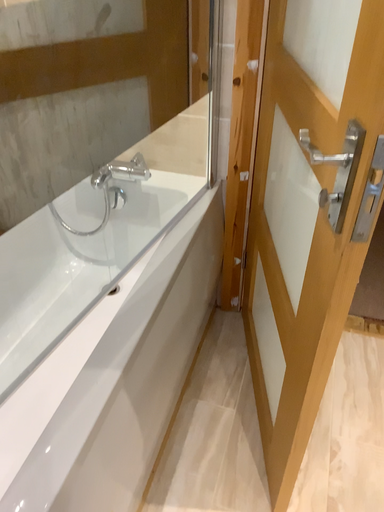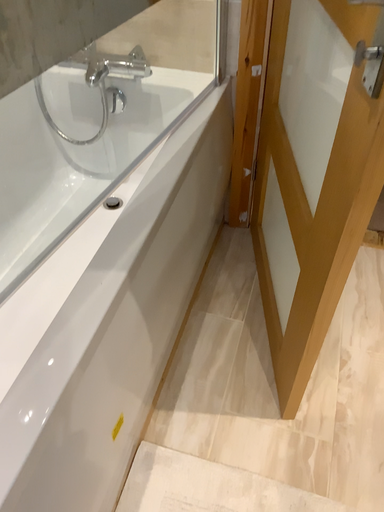
Question: How did the camera likely rotate when shooting the video?

Choices:
 (A) rotated downward
 (B) rotated upward

Answer: (A)